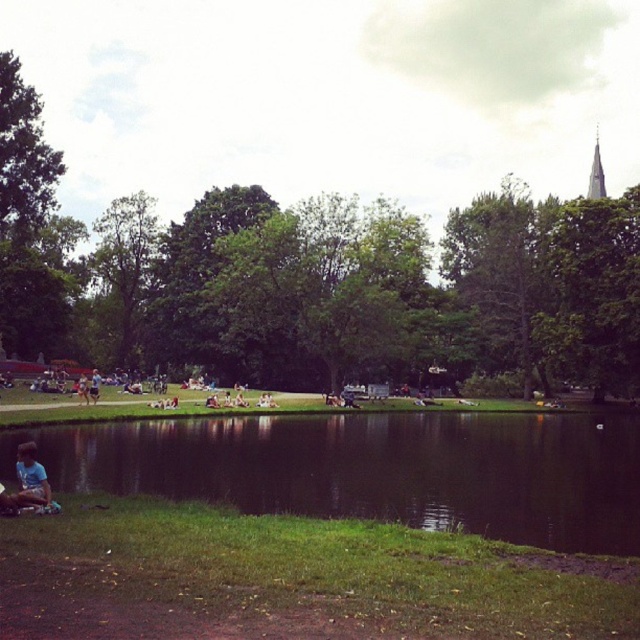
Question: Which point is farther from the camera taking this photo?

Choices:
 (A) (13, 436)
 (B) (88, 392)

Answer: (B)

Question: Among these points, which one is nearest to the camera?

Choices:
 (A) (246, 536)
 (B) (595, 154)
 (C) (45, 486)

Answer: (A)

Question: Does green grass at lower left appear on the left side of green reflective water at lower center?

Choices:
 (A) no
 (B) yes

Answer: (B)

Question: Does light blue fabric shirt at lower left have a greater width compared to gold textured spire at upper right?

Choices:
 (A) yes
 (B) no

Answer: (B)

Question: Is the position of green grass at lower left more distant than that of light blue fabric at lower left?

Choices:
 (A) yes
 (B) no

Answer: (B)

Question: Which point is closer to the camera?

Choices:
 (A) green grass at lower left
 (B) green reflective water at lower center
 (C) gold textured spire at upper right
 (D) light blue fabric at lower left

Answer: (A)